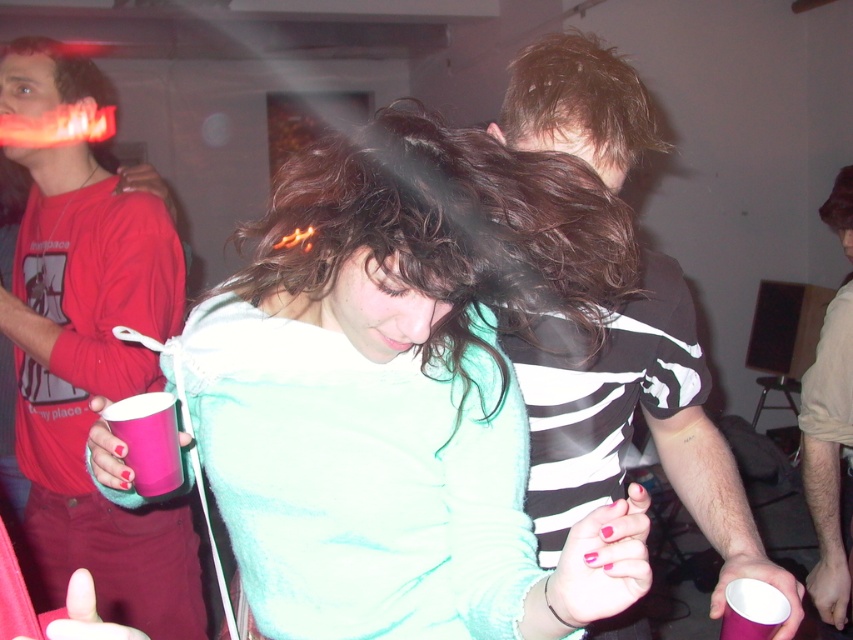
You are at a party and want to take a photo of the two points in the image. The first point is at coordinate point (532,195) and the second is at point (670,352). Which point will appear larger in your photo?

Point (532,195) is closer to the camera than point (670,352), so it will appear larger in the photo.